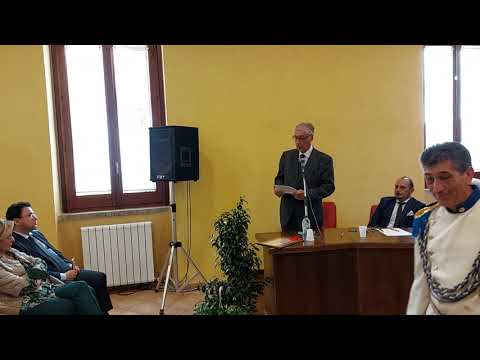
Where is `plant`? The height and width of the screenshot is (360, 480). plant is located at coordinates (219, 301), (232, 241).